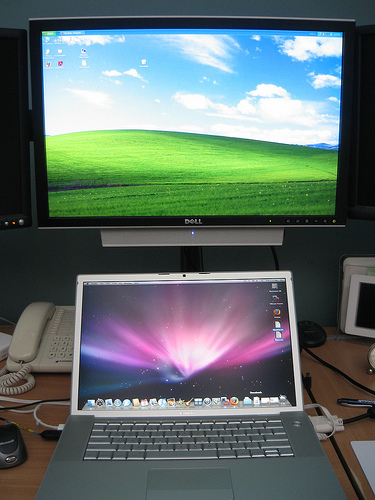
Find the location of a particular element. Image resolution: width=375 pixels, height=500 pixels. off white phone receiver handle is located at coordinates (31, 327).